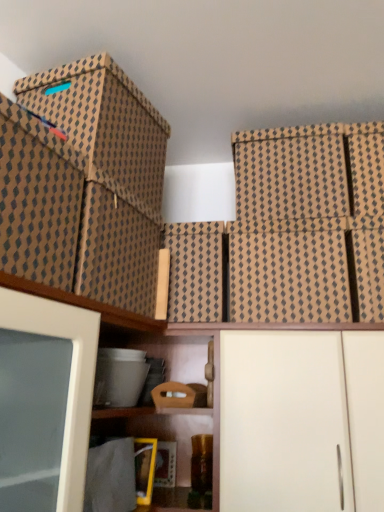
Question: Which direction should I rotate to face brown textured box at center, which ranks as the sixth storage box in left-to-right order, — up or down?

Choices:
 (A) up
 (B) down

Answer: (B)

Question: Can you confirm if wooden box at center, which is the fourth storage box in left-to-right order, is positioned to the left of brown cardboard box at upper right, which ranks as the 8th storage box in left-to-right order?

Choices:
 (A) no
 (B) yes

Answer: (B)

Question: Does wooden box at center, which is the fourth storage box in left-to-right order, have a lesser width compared to brown cardboard box at upper right, which ranks as the 8th storage box in left-to-right order?

Choices:
 (A) no
 (B) yes

Answer: (B)

Question: Does wooden box at center, the sixth storage box positioned from the right, lie in front of brown cardboard box at upper right, which ranks as the 8th storage box in left-to-right order?

Choices:
 (A) no
 (B) yes

Answer: (A)

Question: Is wooden box at center, the sixth storage box positioned from the right, positioned beyond the bounds of brown cardboard box at upper right, which ranks as the second storage box in right-to-left order?

Choices:
 (A) no
 (B) yes

Answer: (B)

Question: From the image's perspective, is wooden box at center, which is the fourth storage box in left-to-right order, located above brown cardboard box at upper right, which ranks as the 8th storage box in left-to-right order?

Choices:
 (A) yes
 (B) no

Answer: (B)

Question: Is wooden box at center, which is the fourth storage box in left-to-right order, taller than brown cardboard box at upper right, which ranks as the second storage box in right-to-left order?

Choices:
 (A) no
 (B) yes

Answer: (A)

Question: Can you confirm if wooden box at center, the sixth storage box positioned from the right, is wider than white matte plastic storage box at lower center, positioned as the third storage box in left-to-right order?

Choices:
 (A) yes
 (B) no

Answer: (A)

Question: Does wooden box at center, the sixth storage box positioned from the right, have a lesser height compared to white matte plastic storage box at lower center, which ranks as the 7th storage box in right-to-left order?

Choices:
 (A) yes
 (B) no

Answer: (A)

Question: Considering the relative sizes of wooden box at center, which is the fourth storage box in left-to-right order, and white matte plastic storage box at lower center, positioned as the third storage box in left-to-right order, in the image provided, is wooden box at center, which is the fourth storage box in left-to-right order, bigger than white matte plastic storage box at lower center, positioned as the third storage box in left-to-right order,?

Choices:
 (A) no
 (B) yes

Answer: (A)

Question: Are wooden box at center, the sixth storage box positioned from the right, and white matte plastic storage box at lower center, which ranks as the 7th storage box in right-to-left order, beside each other?

Choices:
 (A) yes
 (B) no

Answer: (B)

Question: Are wooden box at center, which is the fourth storage box in left-to-right order, and white matte plastic storage box at lower center, which ranks as the 7th storage box in right-to-left order, located far from each other?

Choices:
 (A) yes
 (B) no

Answer: (B)

Question: Considering the relative sizes of wooden box at center, the sixth storage box positioned from the right, and white matte plastic storage box at lower center, positioned as the third storage box in left-to-right order, in the image provided, is wooden box at center, the sixth storage box positioned from the right, taller than white matte plastic storage box at lower center, positioned as the third storage box in left-to-right order,?

Choices:
 (A) yes
 (B) no

Answer: (B)

Question: From a real-world perspective, is brown textured box at upper right, acting as the 1th storage box starting from the right, positioned over wooden box at center, the sixth storage box positioned from the right, based on gravity?

Choices:
 (A) yes
 (B) no

Answer: (A)